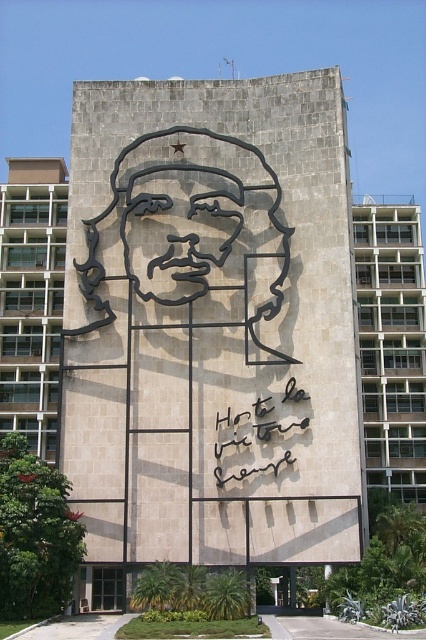
You are an art student analyzing the building facade. You notice the white matte text at center and the black matte sculpture at center. Which one has a greater height?

The black matte sculpture at center is taller than the white matte text at center.

You are an art student analyzing the building facade. You notice two central elements, the white matte text at center and the black matte sculpture at center. Which one is positioned higher up on the facade?

The black matte sculpture at center is positioned higher up on the facade since the white matte text at center is located below it.